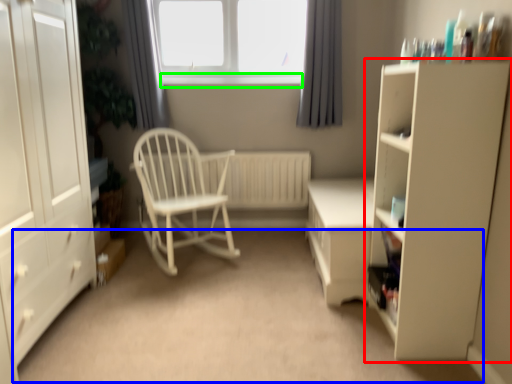
Question: Which is farther away from cupboard (highlighted by a red box)? plain (highlighted by a blue box) or window sill (highlighted by a green box)?

Choices:
 (A) plain
 (B) window sill

Answer: (B)